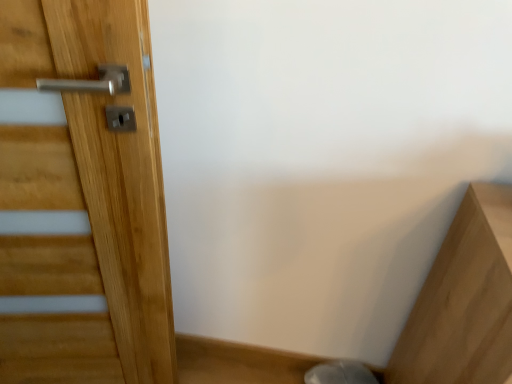
Describe the element at coordinates (106, 162) in the screenshot. The image size is (512, 384). I see `natural wood door at left` at that location.

Locate an element on the screen. natural wood door at left is located at coordinates tap(106, 162).

This screenshot has width=512, height=384. What are the coordinates of `natural wood door at left` in the screenshot? It's located at (106, 162).